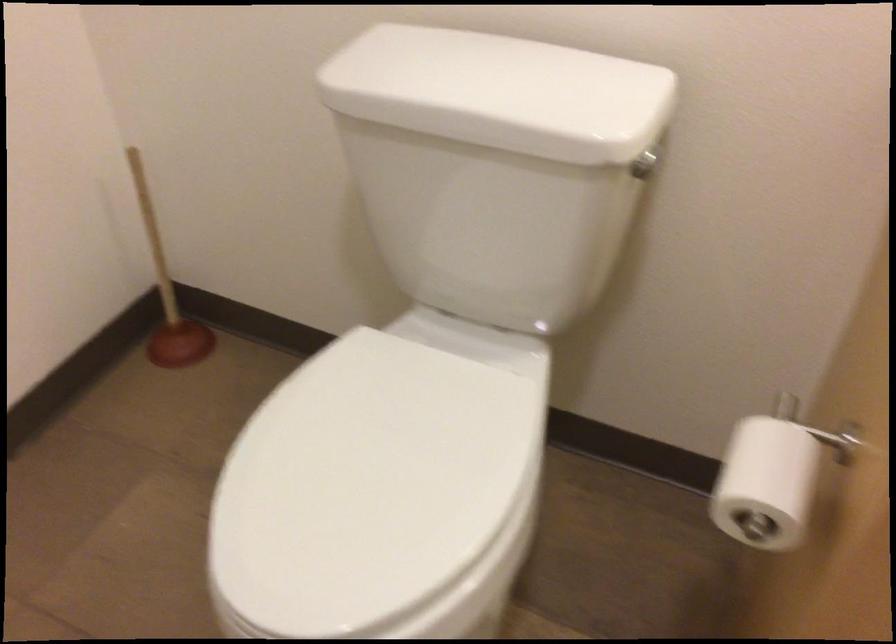
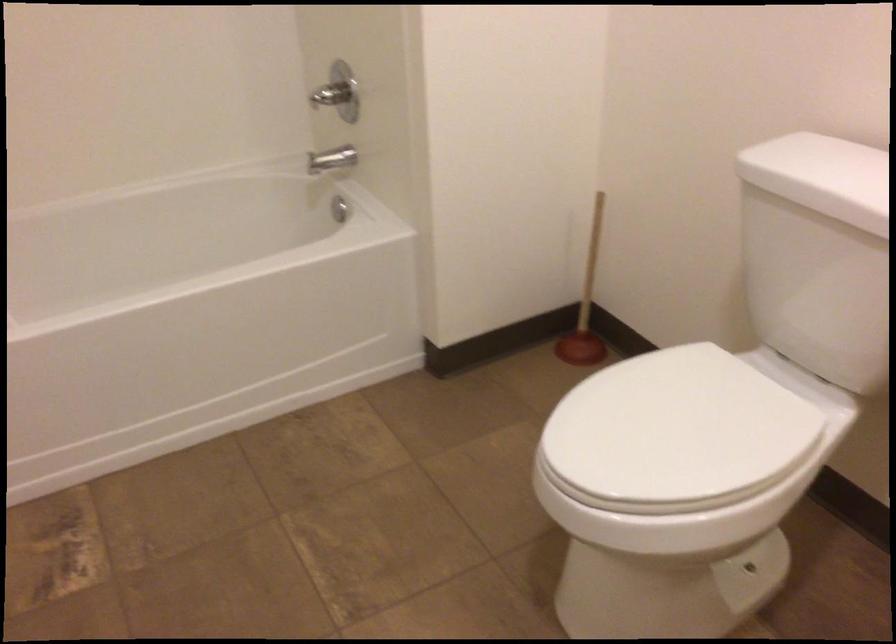
Locate, in the second image, the point that corresponds to pixel 177 298 in the first image.

(586, 305)